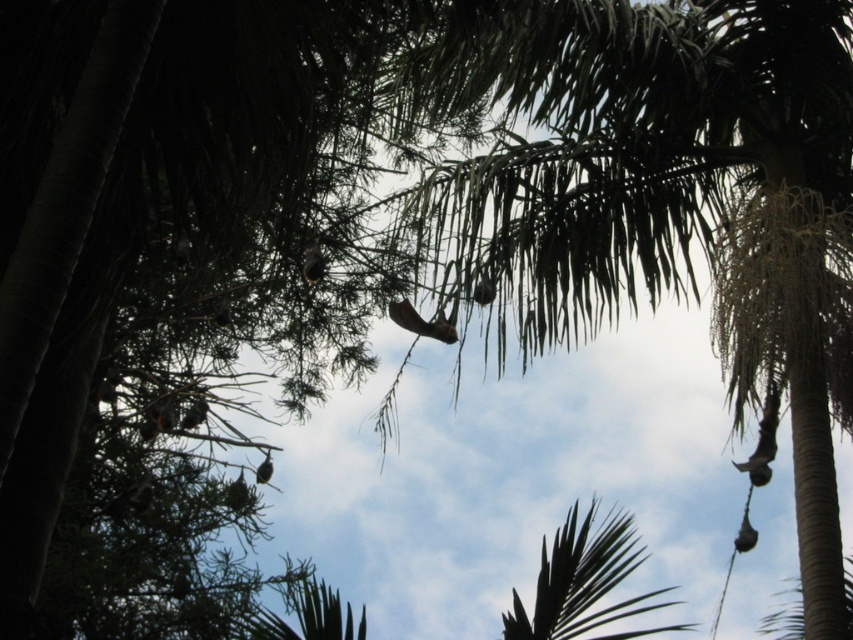
You are a bird flying at eye level with the green leafy palm at center. Looking up, can you see the top of the green leafy palm tree at upper center?

The green leafy palm tree at upper center is taller than the green leafy palm at center, so yes, you can see its top when looking up from the eye level of the green leafy palm at center.

You are a bird flying above the palm trees in the image. You want to land on the point at coordinate (660, 195). Is this point located on a green leafy palm tree at upper center?

Yes, the point at coordinate (660, 195) is on the green leafy palm tree at upper center.

You are standing on the ground looking up at the two palm trees. The first is the green leafy palm tree at upper center and the second is the green leafy palm at center. Which tree is closer to you?

The green leafy palm at center is closer to you because it is positioned lower in the image compared to the green leafy palm tree at upper center, which is further away.